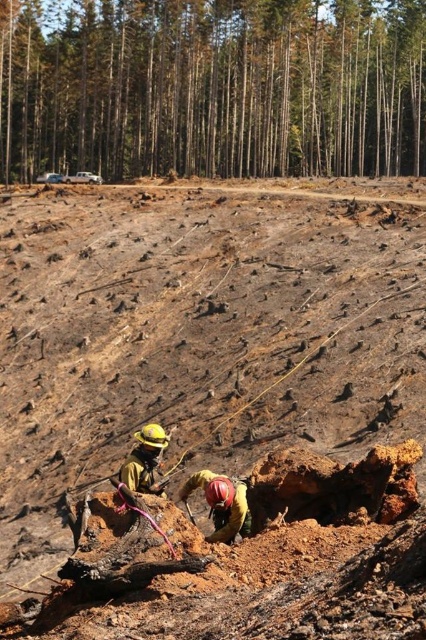
Is point (265, 8) positioned after point (149, 468)?

Yes, point (265, 8) is farther from viewer.

Is brown wood tree at upper center closer to the viewer compared to yellow hard hat at lower left?

No, it is behind yellow hard hat at lower left.

Does point (411, 157) lie behind point (135, 445)?

That is True.

I want to click on brown wood tree at upper center, so click(x=212, y=88).

Is hard hat helmet at center thinner than yellow hard hat at lower left?

In fact, hard hat helmet at center might be wider than yellow hard hat at lower left.

Is point (227, 516) more distant than point (146, 442)?

No, (227, 516) is in front of (146, 442).

The height and width of the screenshot is (640, 426). In order to click on hard hat helmet at center in this screenshot , I will do `click(221, 502)`.

Can you confirm if brown wood tree at upper center is positioned above hard hat helmet at center?

Yes.

Is brown wood tree at upper center closer to camera compared to hard hat helmet at center?

No.

Is point (69, 54) closer to viewer compared to point (226, 500)?

No, it is not.

Find the location of a particular element. This screenshot has height=640, width=426. brown wood tree at upper center is located at coordinates (212, 88).